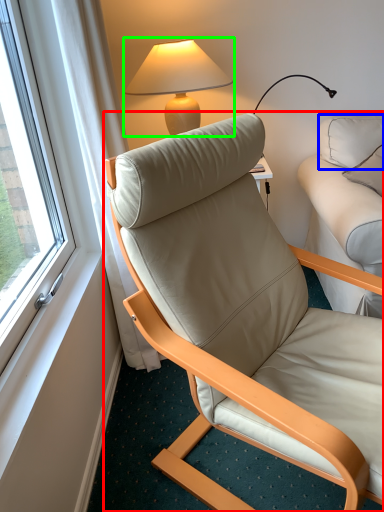
Question: Estimate the real-world distances between objects in this image. Which object is farther from chair (highlighted by a red box), pillow (highlighted by a blue box) or lamp (highlighted by a green box)?

Choices:
 (A) pillow
 (B) lamp

Answer: (A)